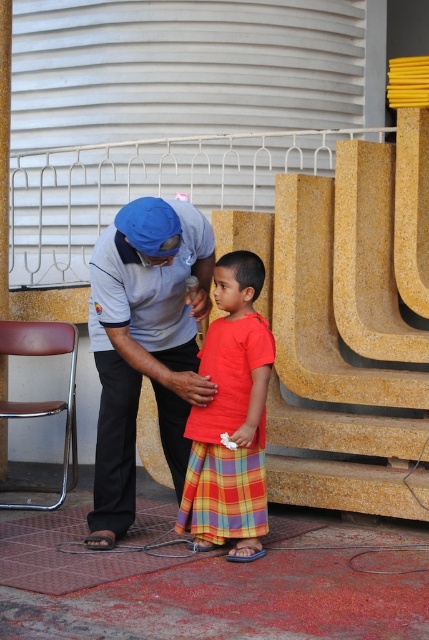
Question: Can you confirm if matte blue cap at center is positioned to the right of red plaid skirt at center?

Choices:
 (A) no
 (B) yes

Answer: (A)

Question: Among these points, which one is farthest from the camera?

Choices:
 (A) (242, 513)
 (B) (96, 484)

Answer: (B)

Question: Which is nearer to the red plaid skirt at center?

Choices:
 (A) plaid cotton kilt at center
 (B) matte blue cap at center

Answer: (A)

Question: Does matte blue cap at center appear under red plaid skirt at center?

Choices:
 (A) no
 (B) yes

Answer: (A)

Question: Does matte blue cap at center appear under red plaid skirt at center?

Choices:
 (A) yes
 (B) no

Answer: (B)

Question: Based on their relative distances, which object is nearer to the matte blue cap at center?

Choices:
 (A) red plaid skirt at center
 (B) plaid cotton kilt at center

Answer: (A)